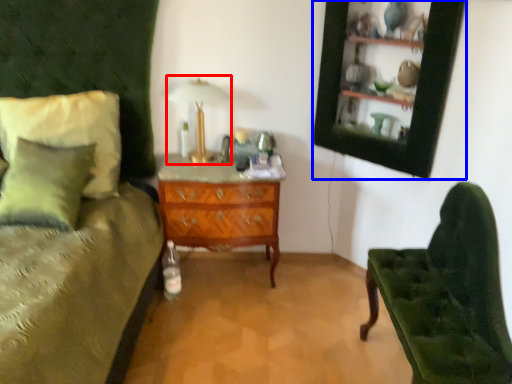
Question: Which of the following is the closest to the observer, table lamp (highlighted by a red box) or picture frame (highlighted by a blue box)?

Choices:
 (A) table lamp
 (B) picture frame

Answer: (B)